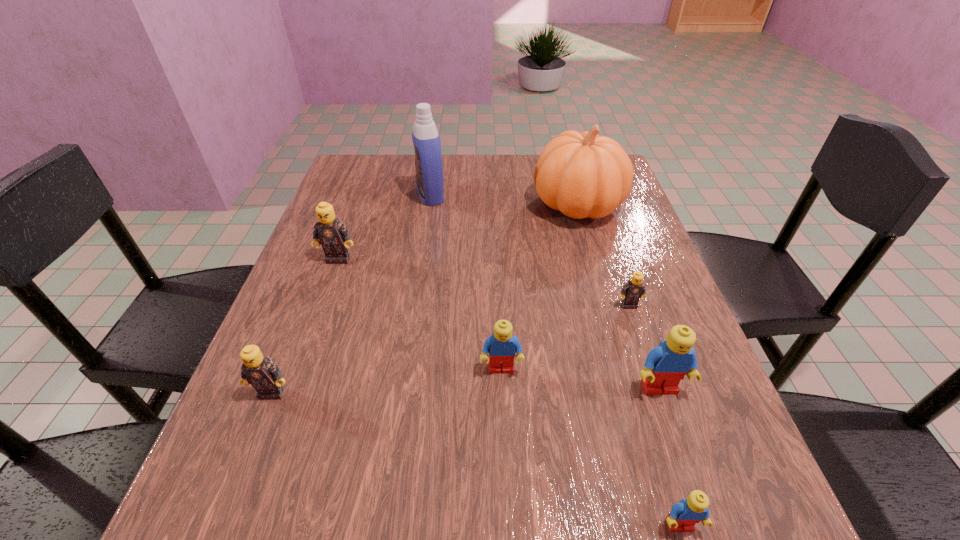
You are a GUI agent. You are given a task and a screenshot of the screen. Output one action in this format:
    pyautogui.click(x=<x>, y=<y>)
    Task: Click on the detergent
    
    Given the screenshot: What is the action you would take?
    pyautogui.click(x=428, y=159)

At what (x,y) coordinates should I click in order to perform the action: click on the third object from left to right. Please return your answer as a coordinate pair (x, y). Looking at the image, I should click on (428, 159).

Find the location of a particular element. This screenshot has width=960, height=540. orange pumpkin is located at coordinates (582, 175).

Where is `the biggest blue Lego`? the biggest blue Lego is located at coordinates (666, 365).

I want to click on the sixth nearest object, so click(333, 235).

This screenshot has height=540, width=960. Find the location of `the farthest Lego`. the farthest Lego is located at coordinates (333, 235).

Find the location of `the second smallest blue Lego`. the second smallest blue Lego is located at coordinates (502, 345).

Where is `the fifth object from right to left`? The width and height of the screenshot is (960, 540). the fifth object from right to left is located at coordinates (502, 345).

I want to click on the second biggest tan Lego, so click(258, 370).

Locate an element on the screen. The height and width of the screenshot is (540, 960). the smallest tan Lego is located at coordinates (634, 289).